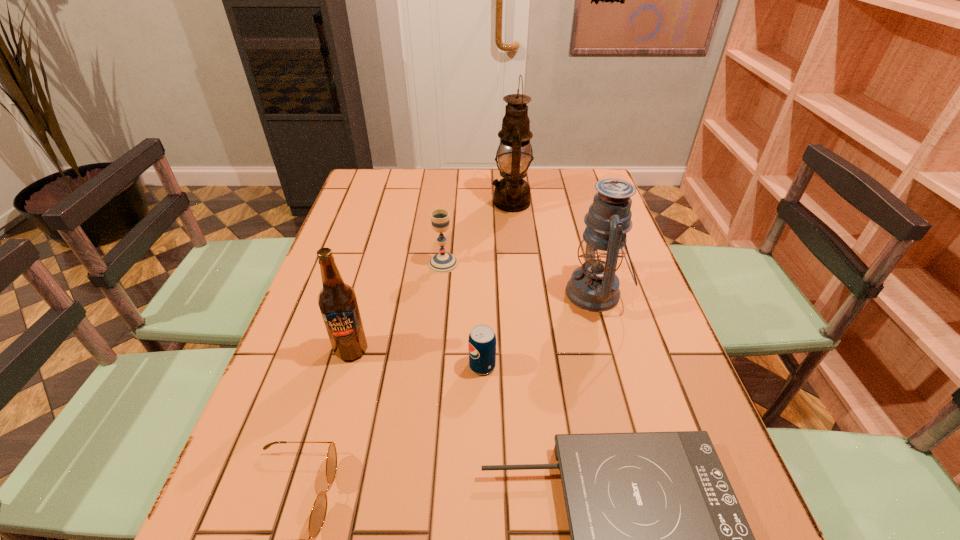
This screenshot has height=540, width=960. Find the location of `vacant space situated 0.400m on the front-facing side of the lantern`. vacant space situated 0.400m on the front-facing side of the lantern is located at coordinates (414, 293).

Where is `vacant space located 0.190m on the label of the beer bottle`? This screenshot has height=540, width=960. vacant space located 0.190m on the label of the beer bottle is located at coordinates (325, 442).

I want to click on vacant space located 0.320m on the right of the chalice, so click(x=571, y=264).

This screenshot has width=960, height=540. What are the coordinates of `free space located 0.330m on the left of the pop` in the screenshot? It's located at (322, 366).

The height and width of the screenshot is (540, 960). Identify the location of object that is at the far edge. (512, 193).

This screenshot has height=540, width=960. Find the location of `object present at the left edge`. object present at the left edge is located at coordinates (337, 301).

Where is `object at the right edge`? The image size is (960, 540). object at the right edge is located at coordinates (594, 286).

In order to click on vacant region at the far edge of the desktop in this screenshot , I will do `click(413, 191)`.

Locate an element on the screen. This screenshot has height=540, width=960. vacant space at the right edge of the desktop is located at coordinates (578, 205).

Locate an element on the screen. The height and width of the screenshot is (540, 960). free space between the third shortest object and the third object from left to right is located at coordinates (463, 314).